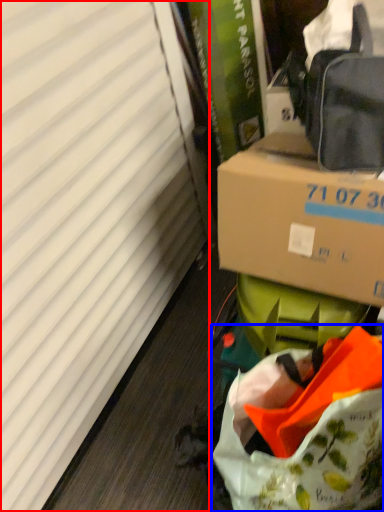
Question: Which object is further to the camera taking this photo, curtain (highlighted by a red box) or bag (highlighted by a blue box)?

Choices:
 (A) curtain
 (B) bag

Answer: (B)